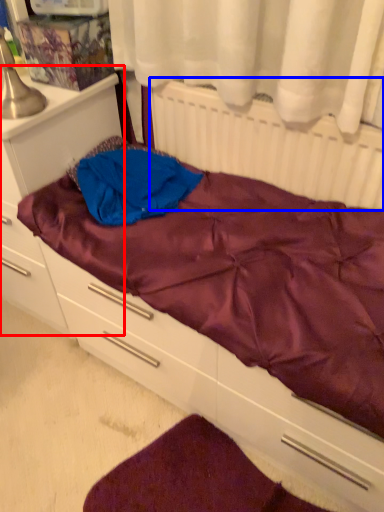
Question: Which object is closer to the camera taking this photo, file cabinet (highlighted by a red box) or radiator (highlighted by a blue box)?

Choices:
 (A) file cabinet
 (B) radiator

Answer: (B)